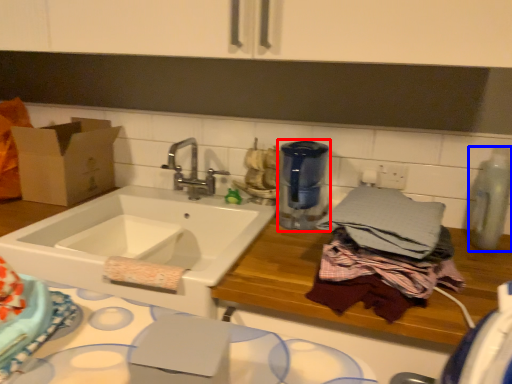
Question: Which point is further to the camera, appliance (highlighted by a red box) or appliance (highlighted by a blue box)?

Choices:
 (A) appliance
 (B) appliance

Answer: (A)